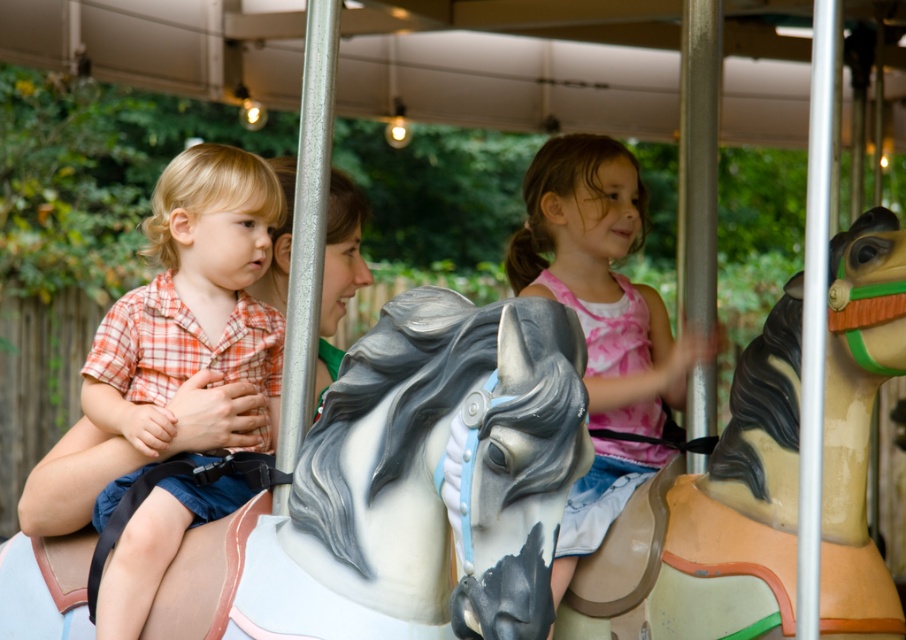
Who is higher up, white glossy horse at left or matte orange plaid shirt at left?

matte orange plaid shirt at left is above.

The width and height of the screenshot is (906, 640). What do you see at coordinates (432, 468) in the screenshot?
I see `white glossy horse at left` at bounding box center [432, 468].

The image size is (906, 640). I want to click on white glossy horse at left, so click(432, 468).

Does point (509, 410) lie behind point (529, 276)?

No.

Is point (394, 529) positioned in front of point (527, 173)?

Yes, it is.

Find the location of a particular element. Image resolution: width=906 pixels, height=640 pixels. white glossy horse at left is located at coordinates (432, 468).

Between point (782, 500) and point (241, 272), which one is positioned behind?

Point (241, 272)

Between matte brown horse at center and matte orange plaid shirt at left, which one appears on the right side from the viewer's perspective?

matte brown horse at center

At what (x,y) coordinates should I click in order to perform the action: click on matte brown horse at center. Please return your answer as a coordinate pair (x, y). The width and height of the screenshot is (906, 640). Looking at the image, I should click on (710, 518).